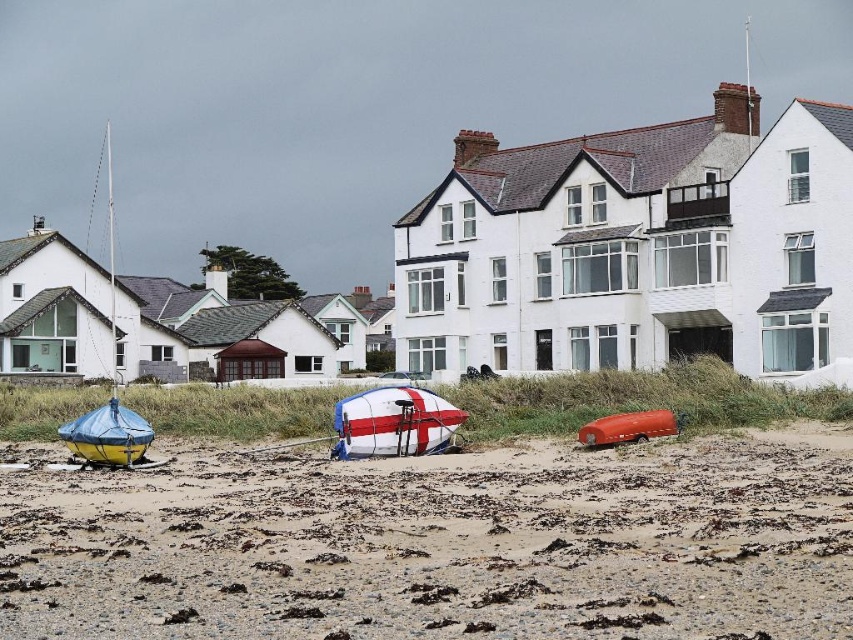
You are standing at the point marked as point (352, 490) in the coastal scene. You want to walk to the nearest boat. The boats are the blue and yellow boat, the red white and blue boat, and the orange boat. Which boat is closest to your current position?

The answer is the orange boat because it is the closest to point (352, 490).